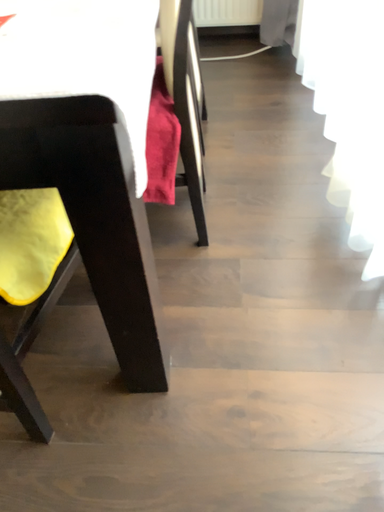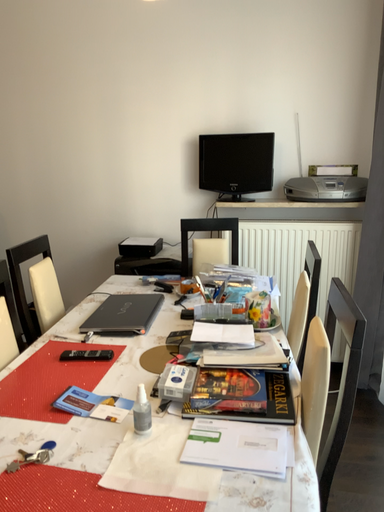
Question: How did the camera likely rotate when shooting the video?

Choices:
 (A) rotated downward
 (B) rotated upward

Answer: (B)